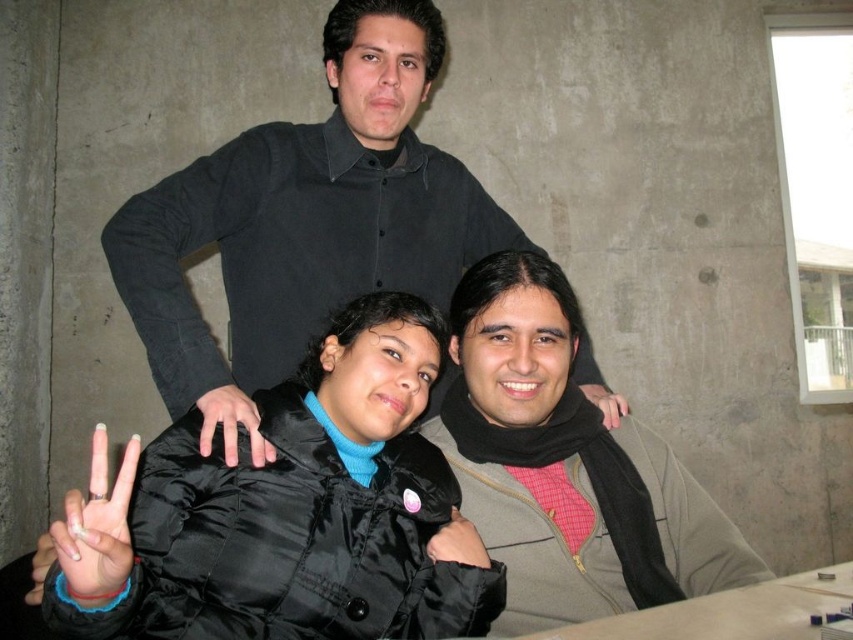
Question: Can you confirm if black matte shirt at upper center is positioned to the right of matte black scarf at center?

Choices:
 (A) no
 (B) yes

Answer: (A)

Question: Which of the following is the farthest from the observer?

Choices:
 (A) black matte hand at center
 (B) matte black hand at lower left
 (C) matte black hand at center
 (D) matte black scarf at center

Answer: (C)

Question: Does matte black scarf at center appear over black matte hand at center?

Choices:
 (A) no
 (B) yes

Answer: (A)

Question: Which of the following is the closest to the observer?

Choices:
 (A) black matte hand at center
 (B) matte black scarf at center
 (C) black satin jacket at center
 (D) matte black hand at center

Answer: (C)

Question: Can you confirm if black satin jacket at center is thinner than matte black hand at lower left?

Choices:
 (A) yes
 (B) no

Answer: (B)

Question: Based on their relative distances, which object is farther from the matte black scarf at center?

Choices:
 (A) black satin jacket at center
 (B) black matte hand at center
 (C) black matte shirt at upper center

Answer: (B)